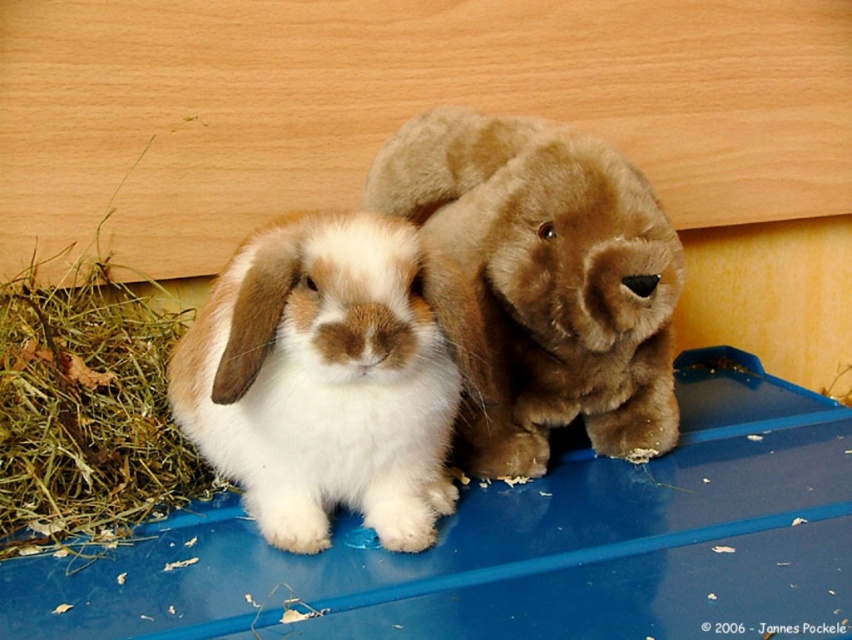
Who is shorter, white soft fur rabbit at center or brown plush toy at center?

Standing shorter between the two is white soft fur rabbit at center.

Is point (383, 304) positioned in front of point (461, 134)?

Yes, it is in front of point (461, 134).

Find the location of a particular element. The image size is (852, 640). white soft fur rabbit at center is located at coordinates (327, 380).

Find the location of `white soft fur rabbit at center`. white soft fur rabbit at center is located at coordinates click(327, 380).